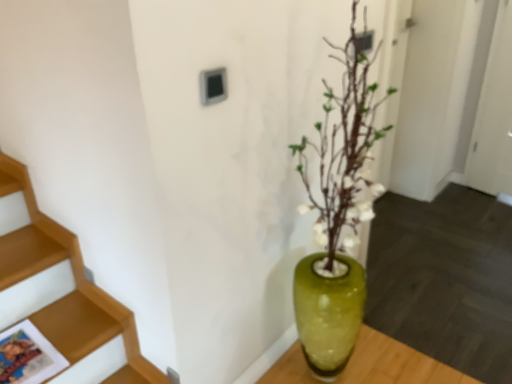
What do you see at coordinates (328, 313) in the screenshot?
I see `green glass vase at center` at bounding box center [328, 313].

Identify the location of green glass vase at center. (328, 313).

Measure the distance between point (x=348, y=201) and camera.

Point (x=348, y=201) and camera are 1.41 meters apart from each other.

Where is `green glass vase at center`? This screenshot has width=512, height=384. green glass vase at center is located at coordinates (338, 212).

Describe the element at coordinates (338, 212) in the screenshot. I see `green glass vase at center` at that location.

Locate an element on the screen. The height and width of the screenshot is (384, 512). green glass vase at center is located at coordinates (328, 313).

Is green glass vase at center at the right side of green glass vase at center?

No, green glass vase at center is not to the right of green glass vase at center.

Considering their positions, is green glass vase at center located in front of or behind green glass vase at center?

Clearly, green glass vase at center is behind green glass vase at center.

Does point (334, 279) come closer to viewer compared to point (361, 289)?

Yes, point (334, 279) is in front of point (361, 289).

From the image's perspective, between green glass vase at center and green glass vase at center, who is located below?

green glass vase at center is shown below in the image.

From a real-world perspective, between green glass vase at center and green glass vase at center, who is vertically lower?

green glass vase at center.

Which object is thinner, green glass vase at center or green glass vase at center?

green glass vase at center.

Which of these two, green glass vase at center or green glass vase at center, stands taller?

green glass vase at center is taller.

Considering the sizes of objects green glass vase at center and green glass vase at center in the image provided, who is smaller, green glass vase at center or green glass vase at center?

Smaller between the two is green glass vase at center.

Is green glass vase at center located outside green glass vase at center?

No, green glass vase at center is inside or overlapping with green glass vase at center.

Is green glass vase at center beside green glass vase at center?

No, green glass vase at center is not beside green glass vase at center.

Is green glass vase at center looking in the opposite direction of green glass vase at center?

Absolutely, green glass vase at center is directed away from green glass vase at center.

How many degrees apart are the facing directions of green glass vase at center and green glass vase at center?

There is a 0.262-degree angle between the facing directions of green glass vase at center and green glass vase at center.

From the picture: How distant is green glass vase at center from green glass vase at center?

13.76 centimeters.

Find the location of a particular element. The width and height of the screenshot is (512, 384). vase located behind the green glass vase at center is located at coordinates (328, 313).

Can you confirm if green glass vase at center is positioned to the left of green glass vase at center?

No, green glass vase at center is not to the left of green glass vase at center.

Which object is further away from the camera taking this photo, green glass vase at center or green glass vase at center?

green glass vase at center is further from the camera.

Considering the positions of points (323, 372) and (312, 307), is point (323, 372) closer to camera compared to point (312, 307)?

No, it is not.

From the image's perspective, would you say green glass vase at center is shown under green glass vase at center?

No, from the image's perspective, green glass vase at center is not below green glass vase at center.

From a real-world perspective, is green glass vase at center positioned above or below green glass vase at center?

green glass vase at center is above green glass vase at center.

Which object is thinner, green glass vase at center or green glass vase at center?

green glass vase at center is thinner.

Between green glass vase at center and green glass vase at center, which one has less height?

Standing shorter between the two is green glass vase at center.

Which of these two, green glass vase at center or green glass vase at center, is smaller?

green glass vase at center is smaller.

Is green glass vase at center positioned beyond the bounds of green glass vase at center?

That's correct, green glass vase at center is outside of green glass vase at center.

Is green glass vase at center with green glass vase at center?

No, green glass vase at center is not with green glass vase at center.

Could you tell me if green glass vase at center is facing green glass vase at center?

No, green glass vase at center is not turned towards green glass vase at center.

What's the angular difference between green glass vase at center and green glass vase at center's facing directions?

There is a 0.262-degree angle between the facing directions of green glass vase at center and green glass vase at center.

Find the location of a particular element. The height and width of the screenshot is (384, 512). vase behind the green glass vase at center is located at coordinates (328, 313).

This screenshot has width=512, height=384. Find the location of `vase that is on the left side of green glass vase at center`. vase that is on the left side of green glass vase at center is located at coordinates (328, 313).

At what (x,y) coordinates should I click in order to perform the action: click on vase below the green glass vase at center (from a real-world perspective). Please return your answer as a coordinate pair (x, y). The height and width of the screenshot is (384, 512). Looking at the image, I should click on (328, 313).